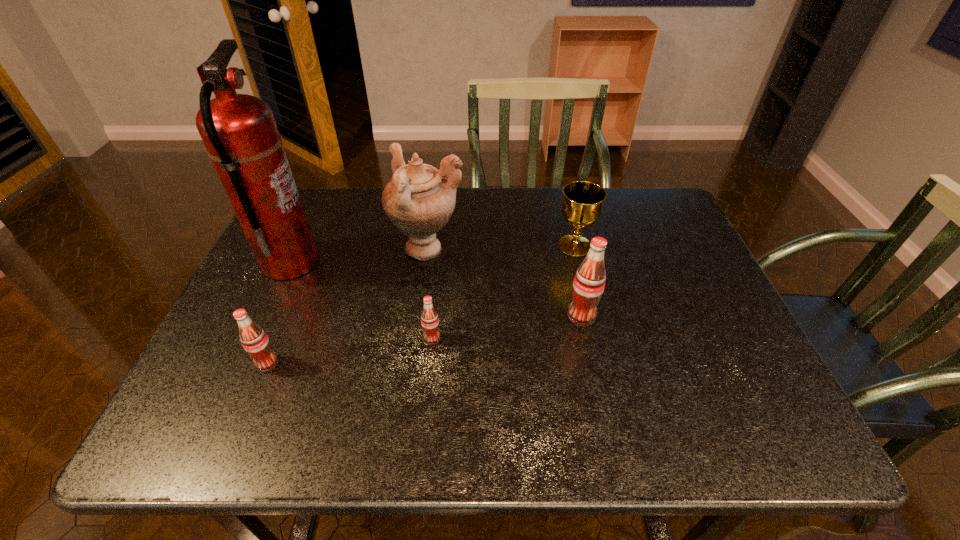
The image size is (960, 540). Identify the location of the leftmost soda. (254, 340).

At what (x,y) coordinates should I click in order to perform the action: click on the second tallest soda. Please return your answer as a coordinate pair (x, y). This screenshot has height=540, width=960. Looking at the image, I should click on (254, 340).

Where is `the second nearest soda`? the second nearest soda is located at coordinates (429, 318).

Identify the location of the shortest soda. (429, 318).

You are a GUI agent. You are given a task and a screenshot of the screen. Output one action in this format:
    pyautogui.click(x=<x>, y=<y>)
    Task: Click on the third nearest object
    
    Given the screenshot: What is the action you would take?
    pyautogui.click(x=589, y=282)

At what (x,y) coordinates should I click in order to perform the action: click on the tallest soda. Please return your answer as a coordinate pair (x, y). Looking at the image, I should click on (589, 282).

At what (x,y) coordinates should I click in order to perform the action: click on the second tallest object. Please return your answer as a coordinate pair (x, y). This screenshot has width=960, height=540. Looking at the image, I should click on (x=418, y=200).

Identify the location of the tallest object. This screenshot has width=960, height=540. (239, 131).

At what (x,y) coordinates should I click in order to perform the action: click on chalice. Please return your answer as a coordinate pair (x, y). Looking at the image, I should click on (583, 200).

Image resolution: width=960 pixels, height=540 pixels. I want to click on vacant area situated 0.390m on the right of the nearest soda, so (461, 363).